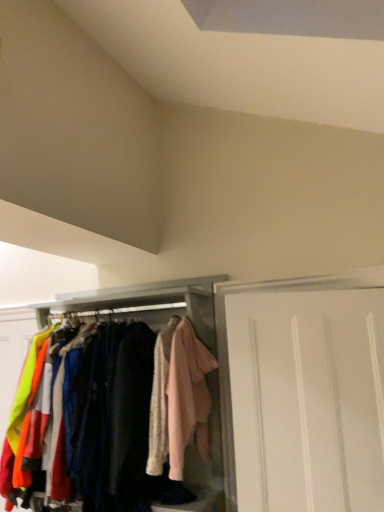
Question: Relative to white matte cabinet at center, is light pink fabric at center in front or behind?

Choices:
 (A) behind
 (B) front

Answer: (B)

Question: In terms of height, does light pink fabric at center look taller or shorter compared to white matte cabinet at center?

Choices:
 (A) tall
 (B) short

Answer: (B)

Question: Which is nearer to the white matte door at right?

Choices:
 (A) white matte cabinet at center
 (B) light pink fabric at center

Answer: (B)

Question: Based on their relative distances, which object is farther from the white matte door at right?

Choices:
 (A) light pink fabric at center
 (B) white matte cabinet at center

Answer: (B)